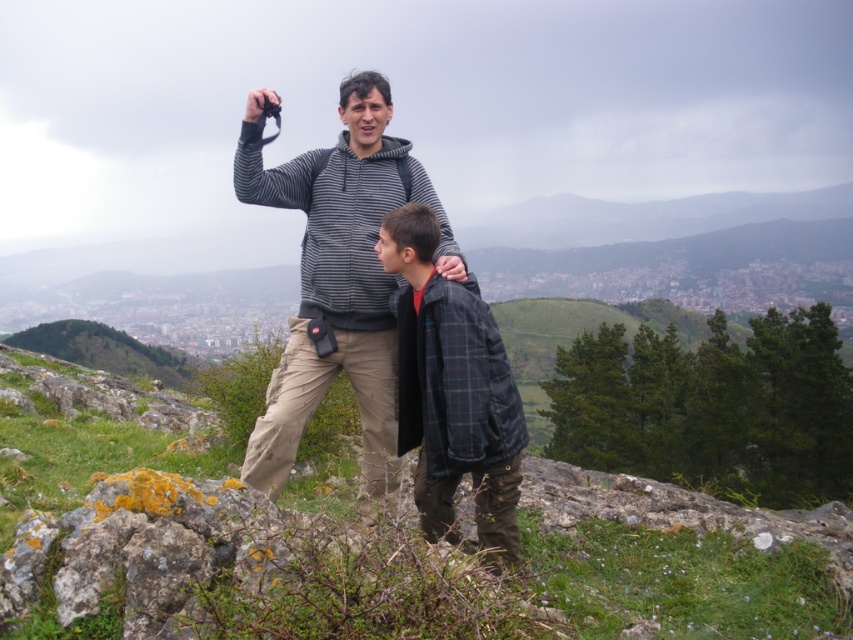
Is striped hoodie at center taller than plaid wool jacket at center?

Yes, striped hoodie at center is taller than plaid wool jacket at center.

Does striped hoodie at center have a larger size compared to plaid wool jacket at center?

Indeed, striped hoodie at center has a larger size compared to plaid wool jacket at center.

Which is in front, point (374, 218) or point (486, 490)?

Point (486, 490) is in front.

The image size is (853, 640). Identify the location of striped hoodie at center. (337, 280).